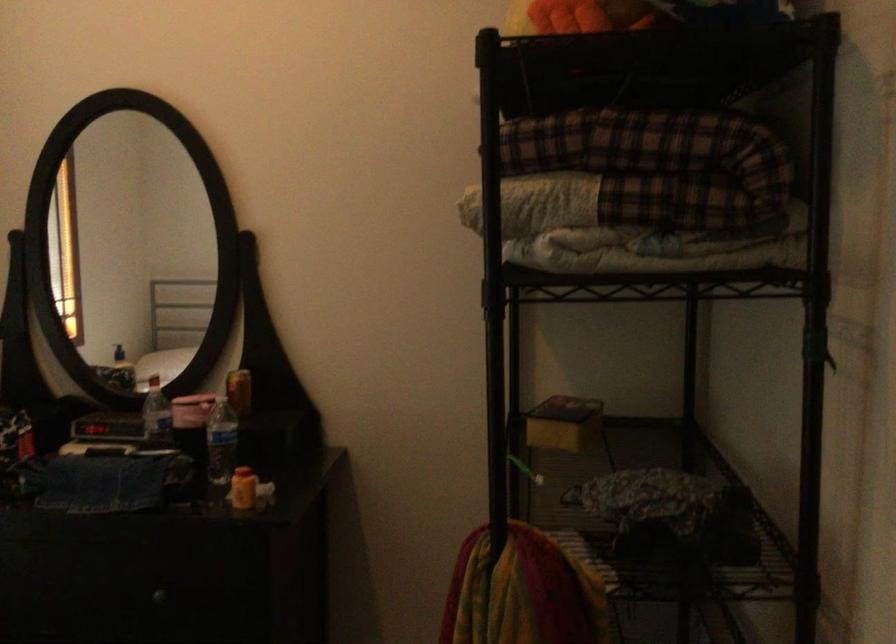
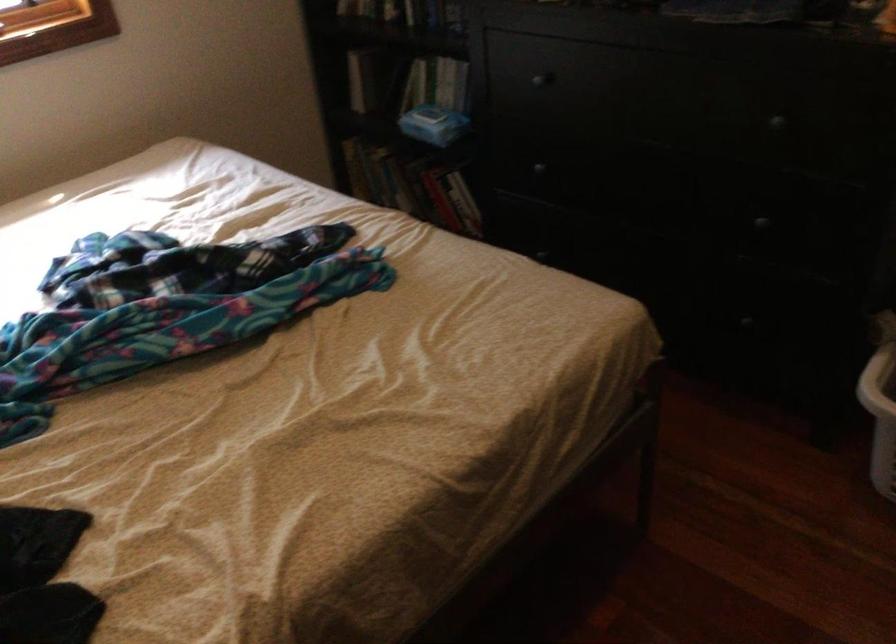
Based on the continuous images, in which direction is the camera rotating?

The camera's rotation is toward left-down.